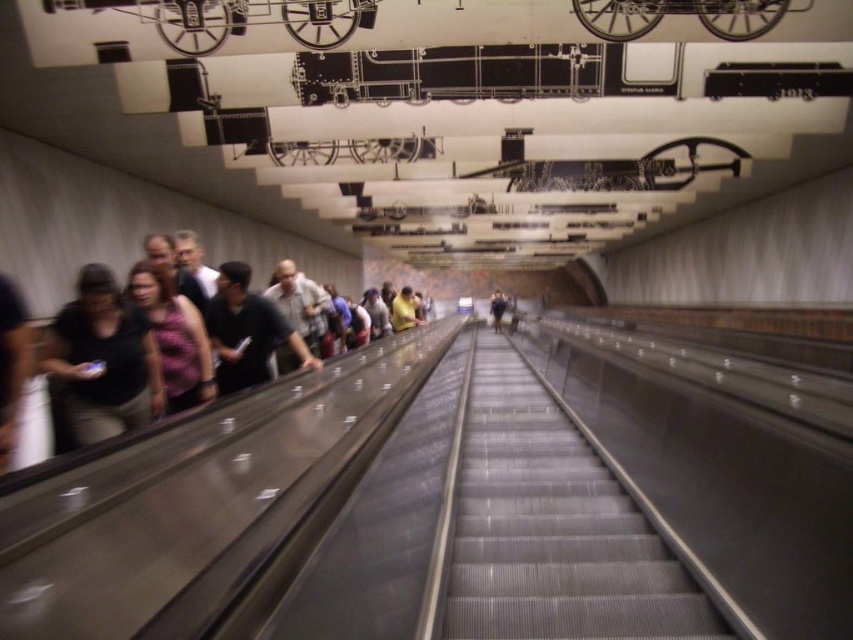
Question: Which of the following is the closest to the observer?

Choices:
 (A) (492, 312)
 (B) (573, 428)

Answer: (B)

Question: Is metallic gray escalator at center wider than light brown leather jacket at center?

Choices:
 (A) yes
 (B) no

Answer: (A)

Question: Is metallic gray escalator at center further to the viewer compared to dark gray shirt at center?

Choices:
 (A) no
 (B) yes

Answer: (A)

Question: Based on their relative distances, which object is farther from the dark gray shirt at left?

Choices:
 (A) purple floral dress at center
 (B) dark gray shirt at center
 (C) light brown leather jacket at center

Answer: (C)

Question: Considering the relative positions of dark gray shirt at center and light brown leather jacket at center in the image provided, where is dark gray shirt at center located with respect to light brown leather jacket at center?

Choices:
 (A) above
 (B) below

Answer: (B)

Question: Among these points, which one is farthest from the camera?

Choices:
 (A) (180, 342)
 (B) (630, 612)

Answer: (A)